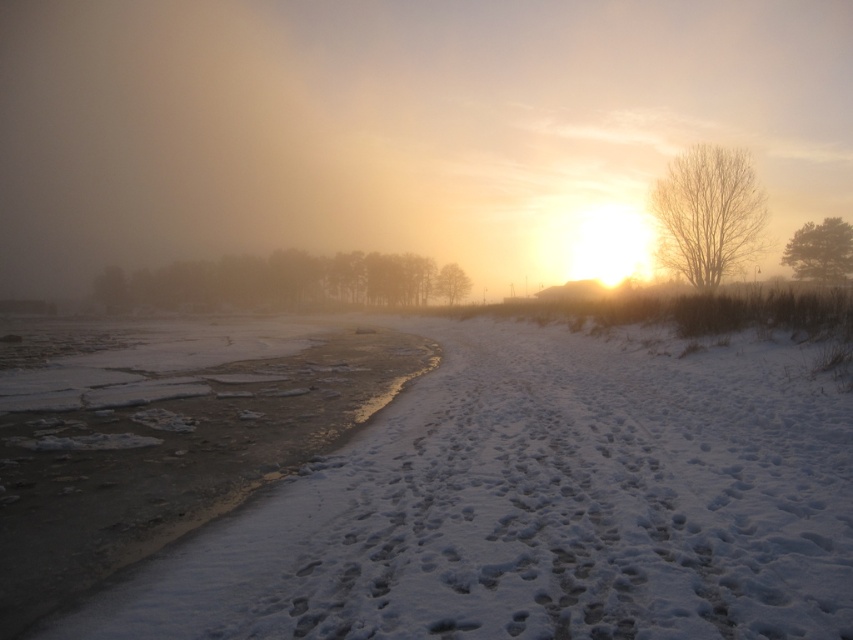
From the picture: Is green matte trees at center positioned at the back of green textured tree at right?

That is True.

Is point (282, 284) in front of point (828, 252)?

No.

Between point (195, 288) and point (836, 248), which one is positioned in front?

Point (836, 248)

Find the location of a particular element. The width and height of the screenshot is (853, 640). green matte trees at center is located at coordinates (286, 282).

Describe the element at coordinates (706, 214) in the screenshot. I see `bare branches at right` at that location.

Who is positioned more to the right, bare branches at right or green textured tree at right?

From the viewer's perspective, green textured tree at right appears more on the right side.

Between point (685, 193) and point (813, 236), which one is positioned behind?

The point (813, 236) is more distant.

At what (x,y) coordinates should I click in order to perform the action: click on bare branches at right. Please return your answer as a coordinate pair (x, y). Looking at the image, I should click on (706, 214).

Can you confirm if green textured tree at right is positioned below smooth brown tree at center?

No, green textured tree at right is not below smooth brown tree at center.

At what (x,y) coordinates should I click in order to perform the action: click on green textured tree at right. Please return your answer as a coordinate pair (x, y). Image resolution: width=853 pixels, height=640 pixels. Looking at the image, I should click on (820, 250).